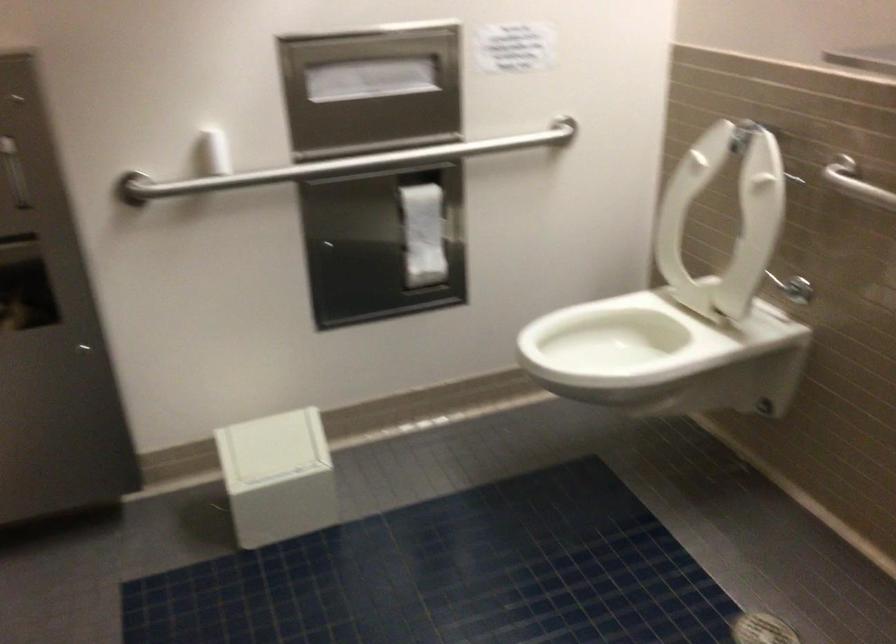
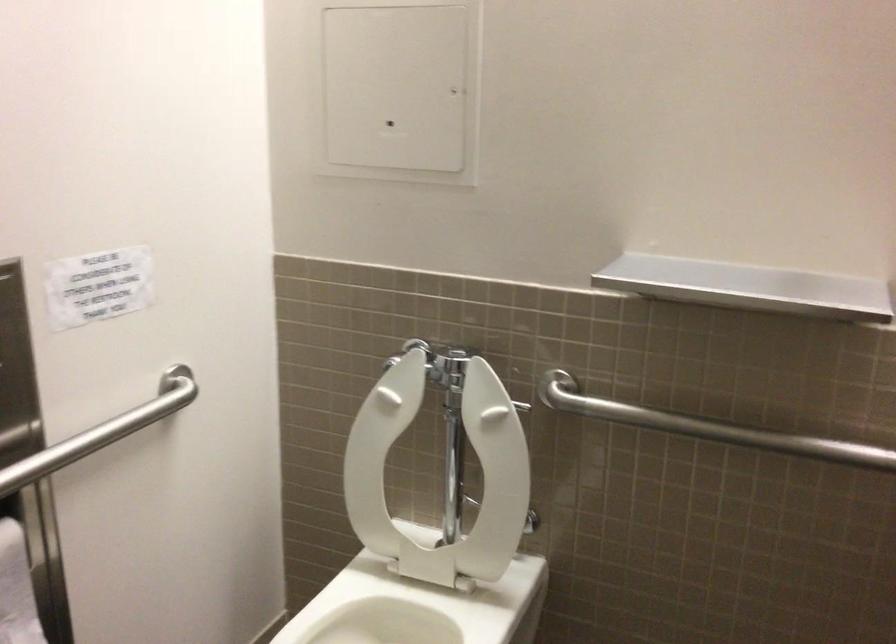
Find the pixel in the second image that matches the point at 745,238 in the first image.

(440, 474)